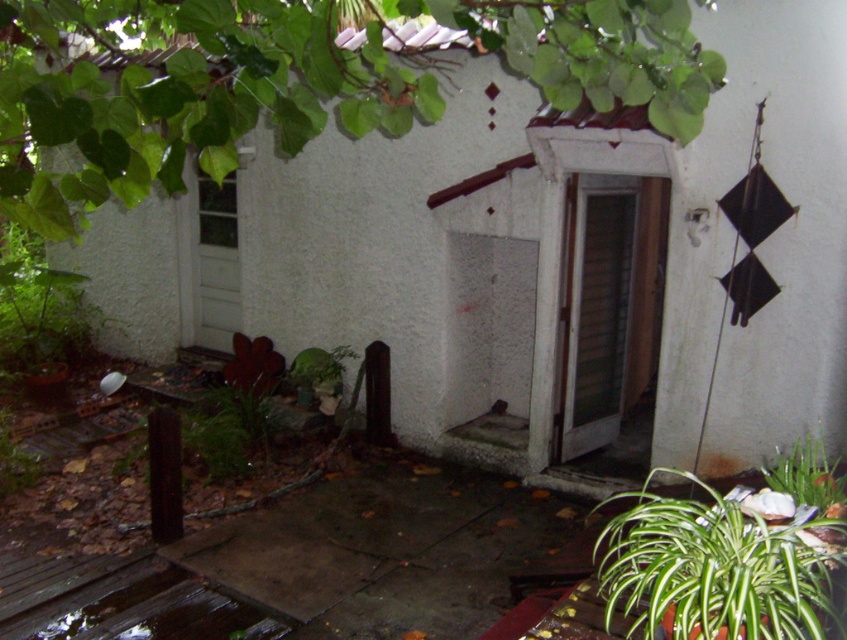
You are standing in front of the wall and want to reach both the point at (554,77) and the point at (737,547). Which point should you reach first if you are moving towards the wall?

You should reach the point at (554,77) first because it is closer to you than the point at (737,547).

You are standing in the outdoor area near the white wall. You need to place a 6.5 feet long ladder between the green leafy tree at upper center and the green leafy plant at lower right. Will the ladder fit between them without bending?

The distance between the green leafy tree at upper center and the green leafy plant at lower right is 6.55 feet. Since the ladder is 6.5 feet long, it will fit between them without bending.

You are a gardener planning to place a new flower pot between the green leafy tree at upper center and the green leafy plant at lower right. Considering their widths, which object should you position the flower pot closer to for better visibility?

The flower pot should be positioned closer to the green leafy plant at lower right because the green leafy tree at upper center is wider, so placing it near the narrower plant will ensure better visibility.